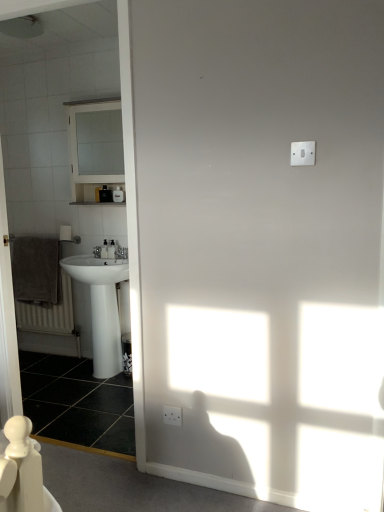
The height and width of the screenshot is (512, 384). Identify the location of vacant area situated below brown textured towel at left (from a real-world perspective). (46, 353).